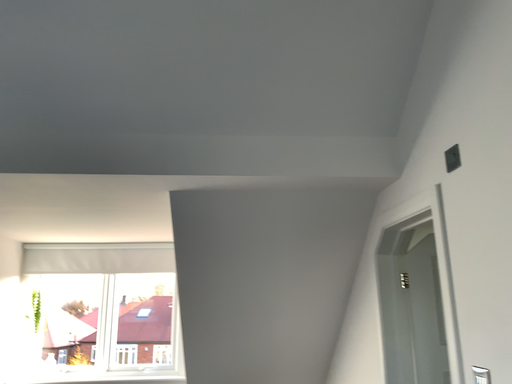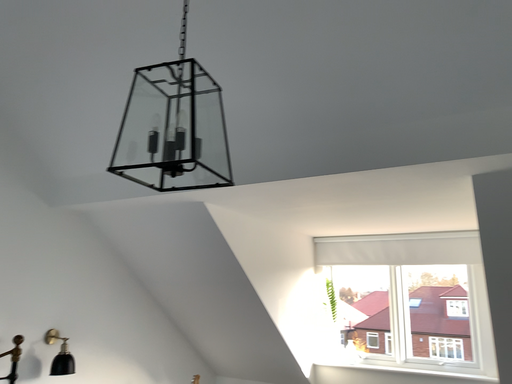
Question: Which way did the camera rotate in the video?

Choices:
 (A) rotated right
 (B) rotated left

Answer: (B)